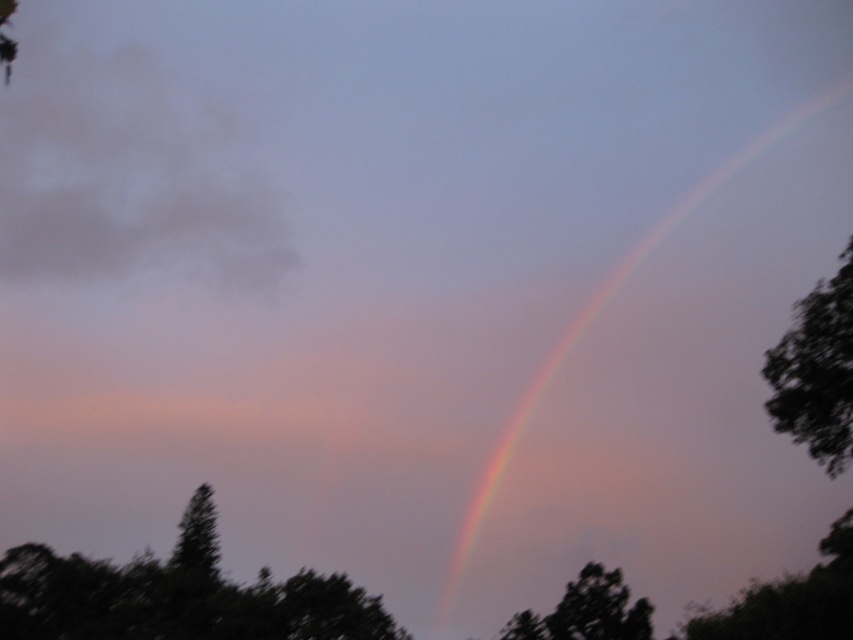
Who is more forward, (791, 120) or (595, 612)?

Point (595, 612) is more forward.

Does rainbow at upper right appear under green leafy tree at lower center?

Incorrect, rainbow at upper right is not positioned below green leafy tree at lower center.

Does point (851, 81) come farther from viewer compared to point (587, 573)?

That is True.

Identify the location of rainbow at upper right. The width and height of the screenshot is (853, 640). 590,324.

Between dark green leafy tree at lower left and rainbow at upper right, which one is positioned lower?

dark green leafy tree at lower left is below.

Does dark green leafy tree at lower left have a lesser height compared to rainbow at upper right?

Correct, dark green leafy tree at lower left is not as tall as rainbow at upper right.

Where is `dark green leafy tree at lower left`? This screenshot has height=640, width=853. dark green leafy tree at lower left is located at coordinates pos(178,595).

Does dark green leafy tree at lower left have a larger size compared to green leafy tree at lower center?

Yes.

Can you confirm if dark green leafy tree at lower left is smaller than green leafy tree at lower center?

Incorrect, dark green leafy tree at lower left is not smaller in size than green leafy tree at lower center.

Is point (239, 586) closer to camera compared to point (514, 612)?

That is False.

At what (x,y) coordinates should I click in order to perform the action: click on dark green leafy tree at lower left. Please return your answer as a coordinate pair (x, y). This screenshot has width=853, height=640. Looking at the image, I should click on (178, 595).